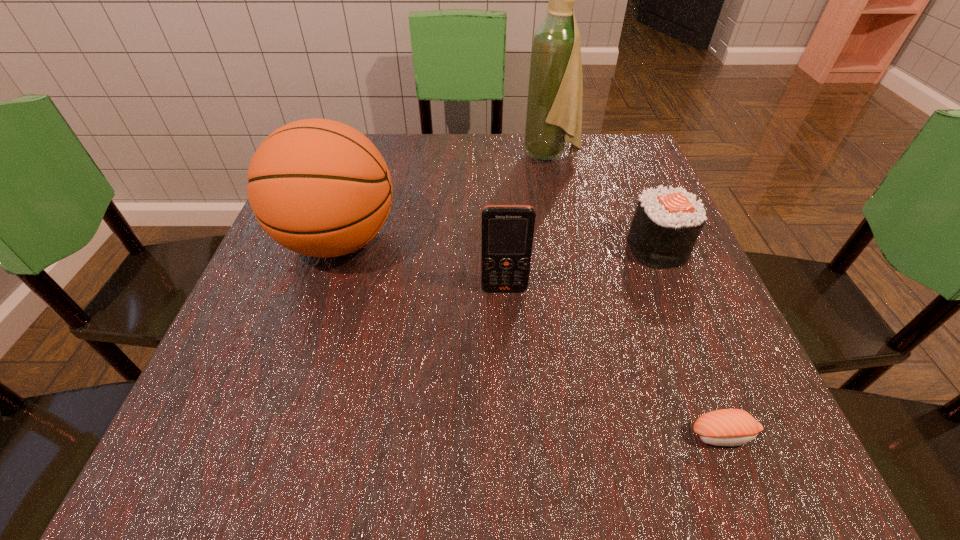
At what (x,y) coordinates should I click in order to perform the action: click on free spot between the nearer sushi and the farthest object. Please return your answer as a coordinate pair (x, y). Looking at the image, I should click on (637, 295).

Where is `free space between the farther sushi and the tallest object`? free space between the farther sushi and the tallest object is located at coordinates (604, 201).

Find the location of a particular element. The height and width of the screenshot is (540, 960). empty space between the wine bottle and the shorter sushi is located at coordinates (637, 295).

Locate an element on the screen. Image resolution: width=960 pixels, height=540 pixels. unoccupied area between the nearer sushi and the tallest object is located at coordinates (637, 295).

Identify the location of free point between the third tallest object and the shortest object. Image resolution: width=960 pixels, height=540 pixels. (614, 362).

Image resolution: width=960 pixels, height=540 pixels. In order to click on vacant space that is in between the third object from left to right and the fourth tallest object in this screenshot , I will do `click(604, 201)`.

Locate an element on the screen. This screenshot has height=540, width=960. vacant region between the taller sushi and the shortest object is located at coordinates (690, 341).

Point out which object is positioned as the fourth nearest to the cellular telephone. Please provide its 2D coordinates. Your answer should be formatted as a tuple, i.e. [(x, y)], where the tuple contains the x and y coordinates of a point satisfying the conditions above.

[(555, 91)]

I want to click on the fourth closest object to the third tallest object, so click(555, 91).

You are a GUI agent. You are given a task and a screenshot of the screen. Output one action in this format:
    pyautogui.click(x=<x>, y=<y>)
    Task: Click on the free space that satisfies the following two spatial constraints: 1. on the front-facing side of the farthest object; 2. on the back side of the nearer sushi
    The width and height of the screenshot is (960, 540).
    Given the screenshot: What is the action you would take?
    pyautogui.click(x=610, y=435)